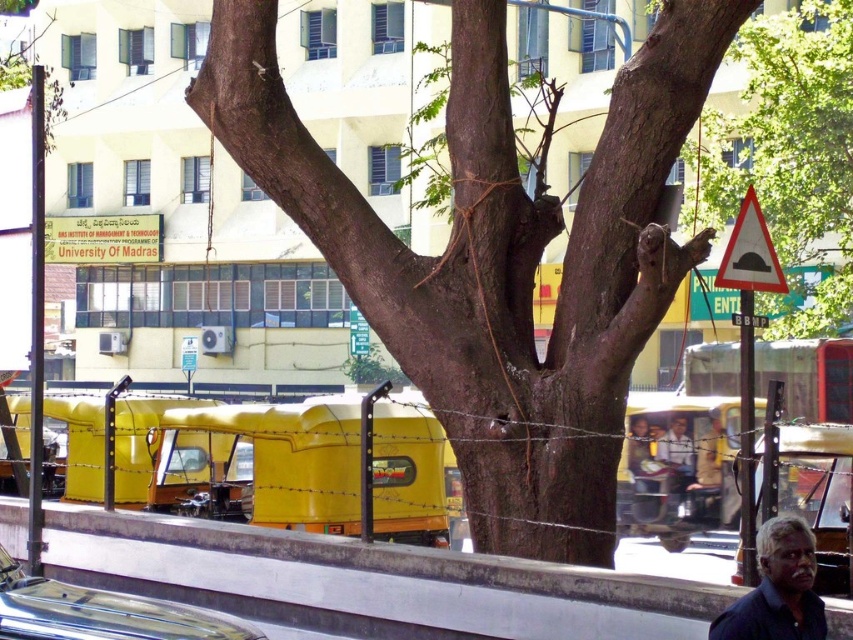
Can you confirm if brown rough bark tree at center is positioned to the right of white concrete pavement at lower center?

Yes, brown rough bark tree at center is to the right of white concrete pavement at lower center.

Who is positioned more to the left, brown rough bark tree at center or white concrete pavement at lower center?

From the viewer's perspective, white concrete pavement at lower center appears more on the left side.

Is point (695, 60) positioned behind point (508, 618)?

Yes.

I want to click on brown rough bark tree at center, so click(498, 259).

Which is in front, point (724, 192) or point (660, 496)?

Point (660, 496) is more forward.

Does point (761, 100) come farther from viewer compared to point (666, 464)?

Yes, it is.

The image size is (853, 640). I want to click on green rough bark tree at upper right, so click(790, 154).

Who is lower down, brown rough bark tree at center or green rough bark tree at upper right?

Positioned lower is brown rough bark tree at center.

Is brown rough bark tree at center positioned before green rough bark tree at upper right?

That is True.

What are the coordinates of `brown rough bark tree at center` in the screenshot? It's located at (498, 259).